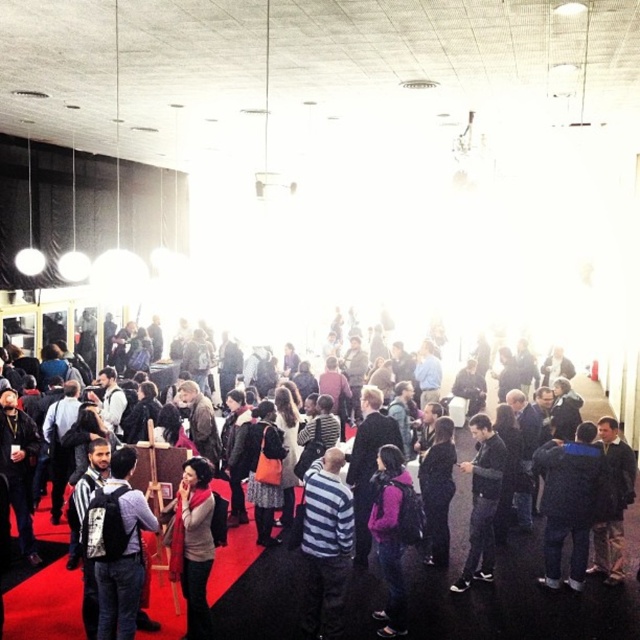
Can you confirm if purple matte jacket at center is bigger than knitted sweater at center?

Yes.

Describe the element at coordinates (394, 532) in the screenshot. The width and height of the screenshot is (640, 640). I see `purple matte jacket at center` at that location.

The height and width of the screenshot is (640, 640). What do you see at coordinates (394, 532) in the screenshot? I see `purple matte jacket at center` at bounding box center [394, 532].

Where is `purple matte jacket at center`? Image resolution: width=640 pixels, height=640 pixels. purple matte jacket at center is located at coordinates (394, 532).

Measure the distance between striped sweater at center and camera.

The distance of striped sweater at center from camera is 6.21 meters.

Is point (429, 634) positioned in front of point (177, 524)?

No.

You are a GUI agent. You are given a task and a screenshot of the screen. Output one action in this format:
    pyautogui.click(x=<x>, y=<y>)
    Task: Click on the striped sweater at center
    The image size is (640, 640).
    Given the screenshot: What is the action you would take?
    pyautogui.click(x=518, y=592)

Can you confirm if knitted sweater at center is positioned to the left of dark gray sweater at center?

Yes, knitted sweater at center is to the left of dark gray sweater at center.

Which is behind, point (189, 563) or point (477, 554)?

Positioned behind is point (477, 554).

Locate an element on the screen. knitted sweater at center is located at coordinates (193, 544).